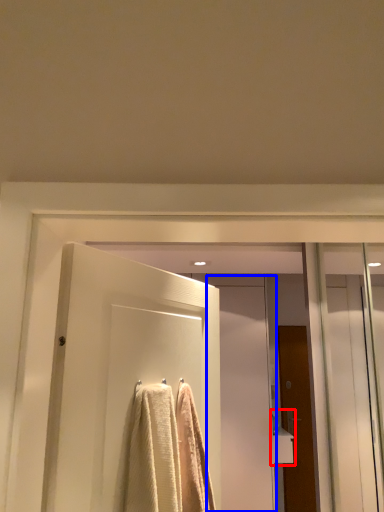
Question: Which point is further to the camera, sink (highlighted by a red box) or screen door (highlighted by a blue box)?

Choices:
 (A) sink
 (B) screen door

Answer: (A)